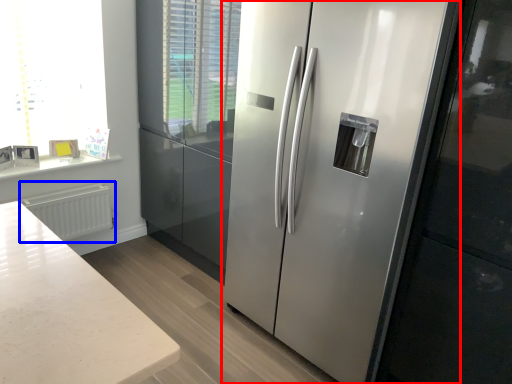
Question: Among these objects, which one is nearest to the camera, refrigerator (highlighted by a red box) or radiator (highlighted by a blue box)?

Choices:
 (A) refrigerator
 (B) radiator

Answer: (A)